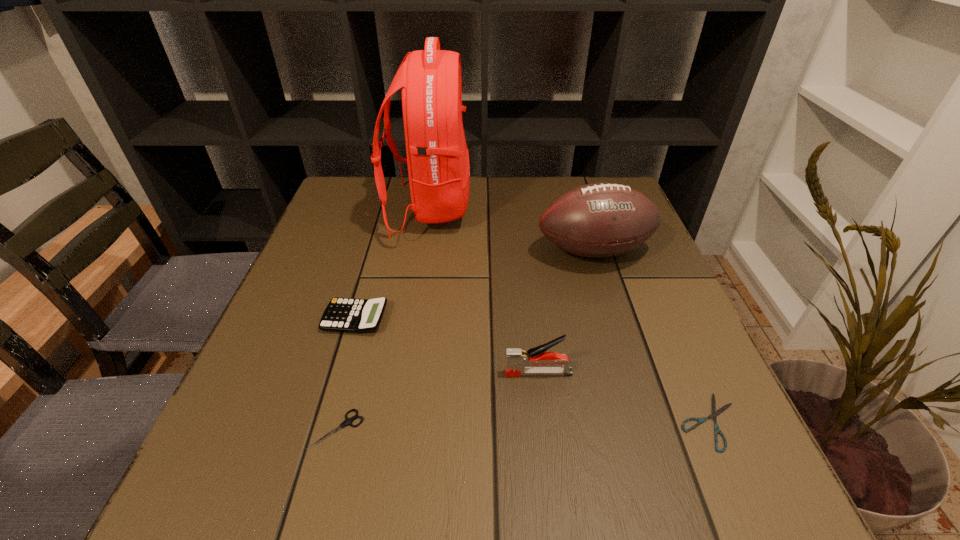
Identify the location of vacant area in the image that satisfies the following two spatial constraints: 1. on the main compartment of the shorter shears; 2. on the right side of the tallest object. (396, 421).

The height and width of the screenshot is (540, 960). Find the location of `vacant space that satisfies the following two spatial constraints: 1. on the main compartment of the backpack; 2. on the left side of the football (American)`. vacant space that satisfies the following two spatial constraints: 1. on the main compartment of the backpack; 2. on the left side of the football (American) is located at coordinates (423, 252).

This screenshot has height=540, width=960. I want to click on free spot that satisfies the following two spatial constraints: 1. on the main compartment of the backpack; 2. on the left side of the football (American), so click(423, 252).

Find the location of a particular element. The height and width of the screenshot is (540, 960). vacant region that satisfies the following two spatial constraints: 1. on the handle side of the stapler; 2. on the right side of the shorter shears is located at coordinates (544, 421).

At what (x,y) coordinates should I click in order to perform the action: click on vacant space that satisfies the following two spatial constraints: 1. on the main compartment of the football (American); 2. on the right side of the backpack. Please return your answer as a coordinate pair (x, y). The width and height of the screenshot is (960, 540). Looking at the image, I should click on (423, 252).

The image size is (960, 540). Find the location of `free space that satisfies the following two spatial constraints: 1. on the front side of the left shears; 2. on the right side of the calculator`. free space that satisfies the following two spatial constraints: 1. on the front side of the left shears; 2. on the right side of the calculator is located at coordinates (323, 429).

Locate an element on the screen. The image size is (960, 540). free space that satisfies the following two spatial constraints: 1. on the main compartment of the tallest object; 2. on the right side of the shortest object is located at coordinates (x=396, y=421).

I want to click on blank space that satisfies the following two spatial constraints: 1. on the handle side of the fourth farthest object; 2. on the right side of the right shears, so click(x=544, y=421).